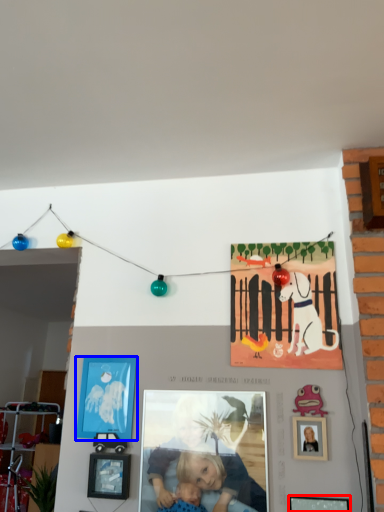
Question: Among these objects, which one is farthest to the camera, picture frame (highlighted by a red box) or picture frame (highlighted by a blue box)?

Choices:
 (A) picture frame
 (B) picture frame

Answer: (B)